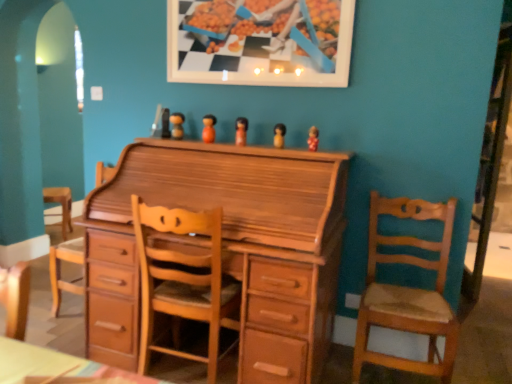
Question: Considering the positions of light brown wood swivel chair at center and wooden figurine at center, marked as the 3th toy in a right-to-left arrangement, in the image, is light brown wood swivel chair at center bigger or smaller than wooden figurine at center, marked as the 3th toy in a right-to-left arrangement,?

Choices:
 (A) small
 (B) big

Answer: (B)

Question: In the image, is light brown wood swivel chair at center positioned in front of or behind wooden figurine at center, marked as the 3th toy in a right-to-left arrangement?

Choices:
 (A) front
 (B) behind

Answer: (A)

Question: Which object is the farthest from the light brown wooden chair at right, the second chair viewed from the left?

Choices:
 (A) wooden figurine at center, which is the first toy from left to right
 (B) matte wooden figurine at center, marked as the 1th toy in a right-to-left arrangement
 (C) brown wooden figurine at center, which ranks as the 4th toy in left-to-right order
 (D) light brown wood chest of drawers at center
 (E) wooden picture frame at upper center

Answer: (A)

Question: Which of these objects is positioned farthest from the matte wooden figurine at center, which is the fifth toy from left to right?

Choices:
 (A) light brown wood swivel chair at center
 (B) light brown wood chest of drawers at center
 (C) wooden figurine at center, marked as the 3th toy in a right-to-left arrangement
 (D) orange matte wooden doll at center, which is the second toy in left-to-right order
 (E) wooden picture frame at upper center

Answer: (A)